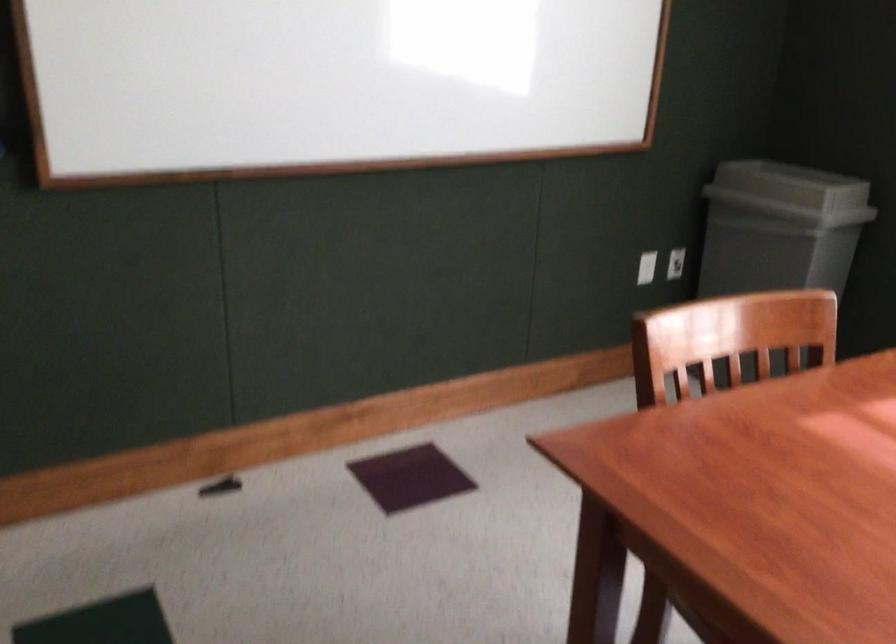
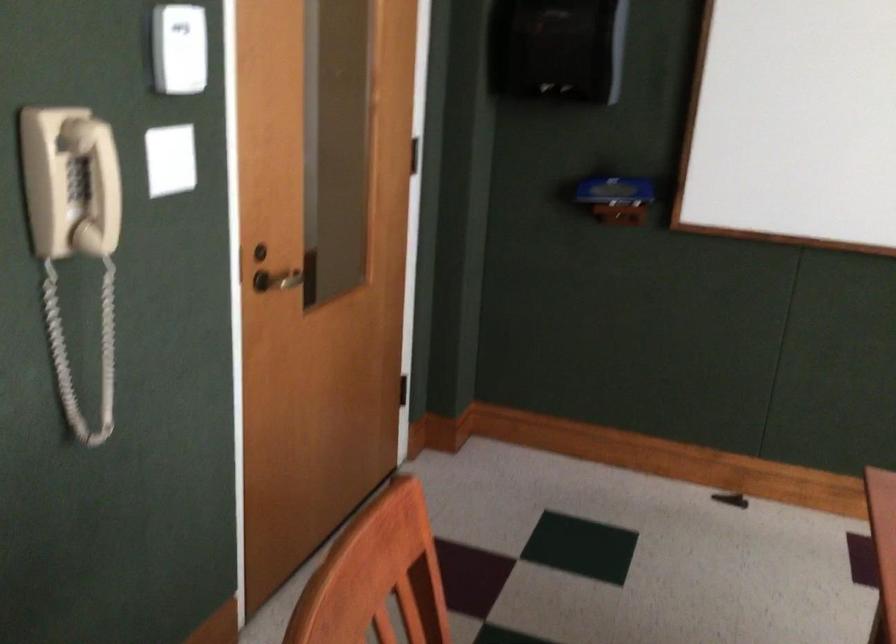
Question: The images are taken continuously from a first-person perspective. In which direction is your viewpoint rotating?

Choices:
 (A) Left
 (B) Right
 (C) Up
 (D) Down

Answer: (A)